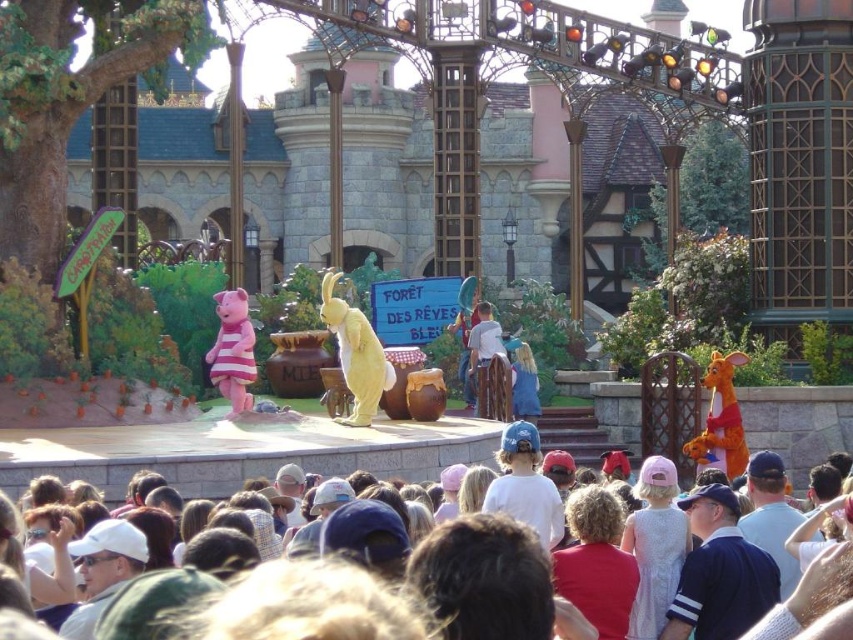
Who is more distant from viewer, (747,358) or (245,337)?

The point (747,358) is more distant.

Is orange plush kangaroo at right below pink fabric pig at center?

Correct, orange plush kangaroo at right is located below pink fabric pig at center.

Which is behind, point (726, 428) or point (234, 326)?

The point (234, 326) is behind.

This screenshot has width=853, height=640. What are the coordinates of `orange plush kangaroo at right` in the screenshot? It's located at pos(720,420).

Does point (6, 483) come in front of point (223, 321)?

Yes, point (6, 483) is closer to viewer.

Is point (227, 464) closer to viewer compared to point (233, 353)?

Yes, it is.

You are a GUI agent. You are given a task and a screenshot of the screen. Output one action in this format:
    pyautogui.click(x=<x>, y=<y>)
    Task: Click on the white cotton crowd at lower center
    
    Given the screenshot: What is the action you would take?
    pyautogui.click(x=61, y=451)

Which of these two, white cotton crowd at lower center or orange plush kangaroo at right, stands shorter?

orange plush kangaroo at right

In the scene shown: Does white cotton crowd at lower center appear on the left side of orange plush kangaroo at right?

Correct, you'll find white cotton crowd at lower center to the left of orange plush kangaroo at right.

Locate an element on the screen. The image size is (853, 640). white cotton crowd at lower center is located at coordinates 61,451.

The width and height of the screenshot is (853, 640). Identify the location of white cotton crowd at lower center. (x=61, y=451).